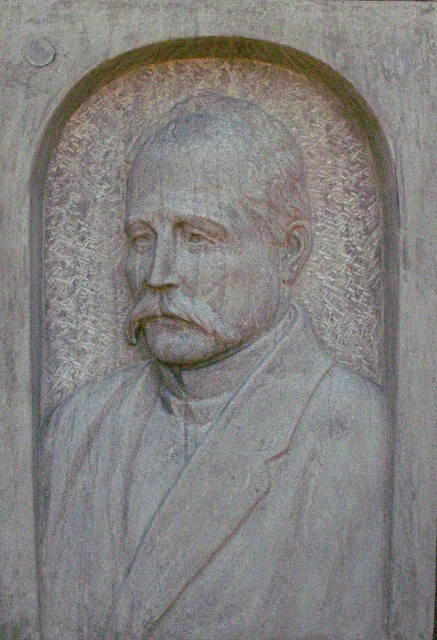
Which of these two, gray stone bust at center or gray stone face at center, stands shorter?

gray stone face at center is shorter.

Who is higher up, gray stone bust at center or gray stone face at center?

gray stone face at center

Does point (159, 516) come farther from viewer compared to point (221, 212)?

Yes.

The height and width of the screenshot is (640, 437). In order to click on gray stone bust at center in this screenshot , I will do `click(217, 419)`.